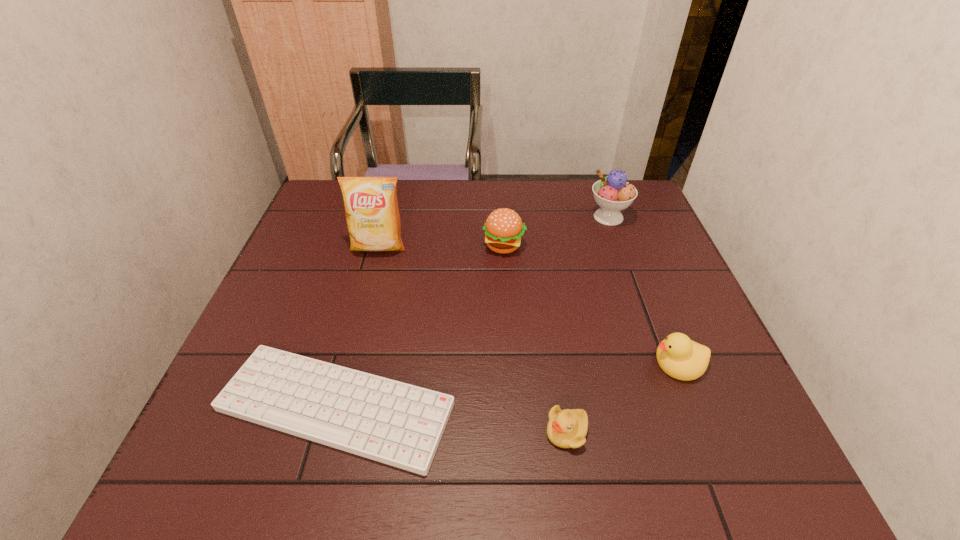
This screenshot has height=540, width=960. What are the coordinates of `vacant space that's between the tallest object and the farther duckling` in the screenshot? It's located at (528, 305).

At what (x,y) coordinates should I click in order to perform the action: click on free space between the fourth tallest object and the crisp (potato chip). Please return your answer as a coordinate pair (x, y). Looking at the image, I should click on (528, 305).

You are a GUI agent. You are given a task and a screenshot of the screen. Output one action in this format:
    pyautogui.click(x=<x>, y=<y>)
    Task: Click on the object that is the fifth nearest to the fourth tallest object
    
    Given the screenshot: What is the action you would take?
    pyautogui.click(x=371, y=207)

Find the location of a particular element. The height and width of the screenshot is (540, 960). object that can be found as the closest to the crisp (potato chip) is located at coordinates (504, 229).